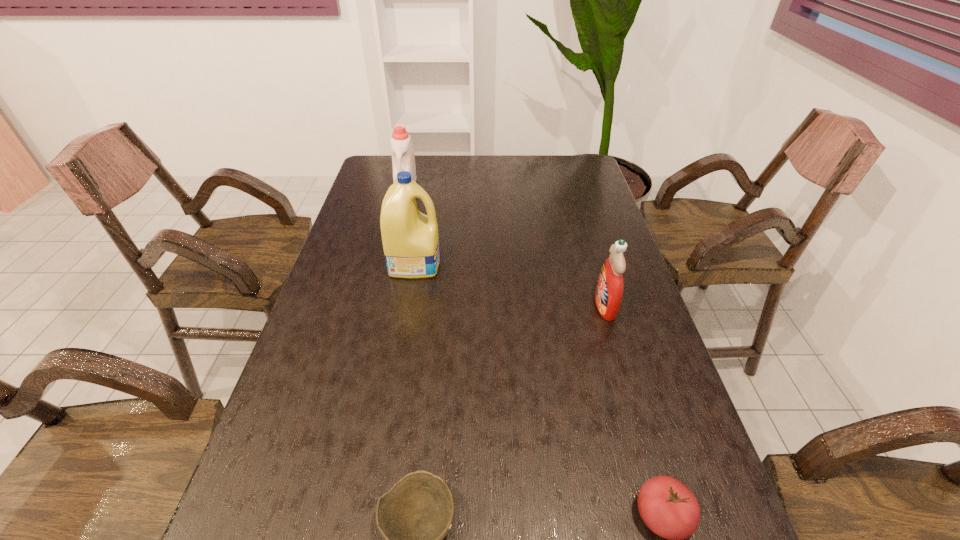
Identify the location of the tallest object. (410, 239).

Locate an element on the screen. Image resolution: width=960 pixels, height=540 pixels. the fourth nearest object is located at coordinates (410, 239).

I want to click on the farthest detergent, so click(x=403, y=159).

Find the location of `the rightmost detergent`. the rightmost detergent is located at coordinates (609, 290).

I want to click on the third nearest object, so click(609, 290).

Find the location of a particular element. This screenshot has height=540, width=960. free space located on the label of the tallest object is located at coordinates (484, 262).

You are a GUI agent. You are given a task and a screenshot of the screen. Output one action in this format:
    pyautogui.click(x=<x>, y=<y>)
    Task: Click on the vacant area situated 0.200m on the handle side of the farthest object
    The height and width of the screenshot is (540, 960).
    Given the screenshot: What is the action you would take?
    pyautogui.click(x=396, y=228)

The height and width of the screenshot is (540, 960). I want to click on free space located 0.240m on the front surface of the nearest detergent, so click(x=505, y=306).

The width and height of the screenshot is (960, 540). I want to click on free spot located on the front surface of the nearest detergent, so click(564, 306).

Identify the location of free space located on the front surface of the nearest detergent. (539, 306).